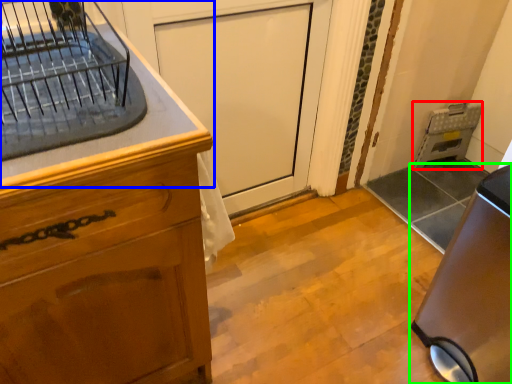
Question: Which object is positioned farthest from appliance (highlighted by a red box)? Select from countertop (highlighted by a blue box) and home appliance (highlighted by a green box).

Choices:
 (A) countertop
 (B) home appliance

Answer: (A)